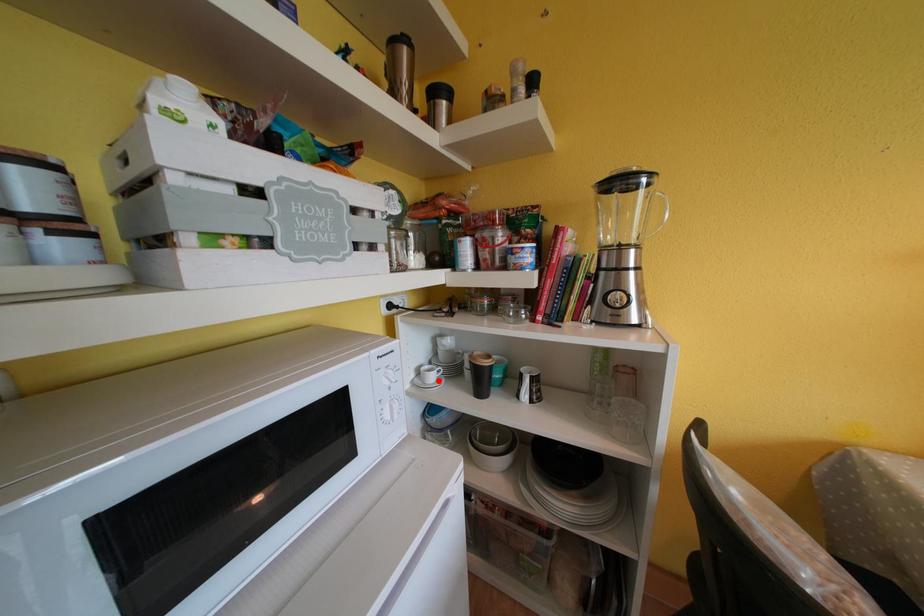
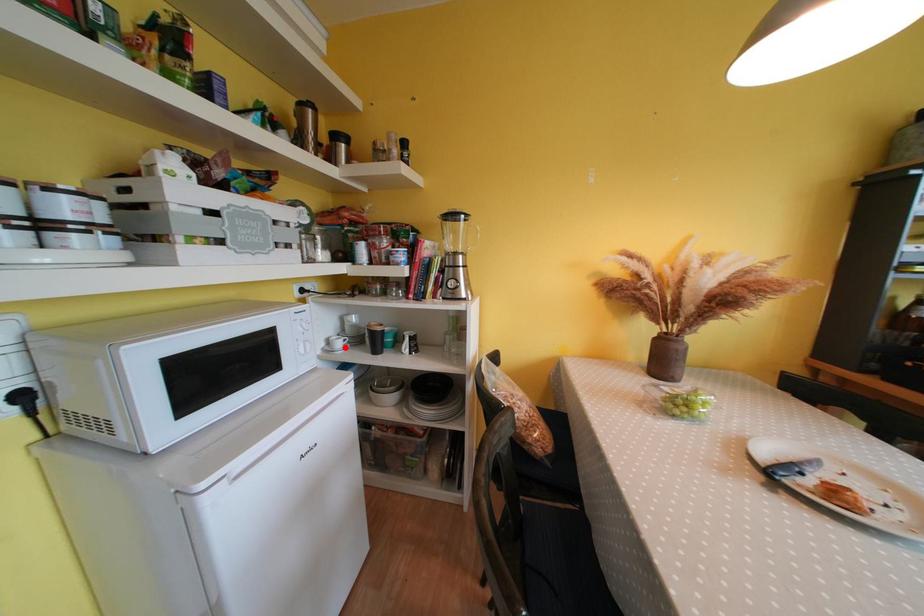
Looking at this image, I am providing you with two images of the same scene from different viewpoints. A red point is marked on the first image and another point is marked on the second image. Are the points marked in image1 and image2 representing the same 3D position?

Yes